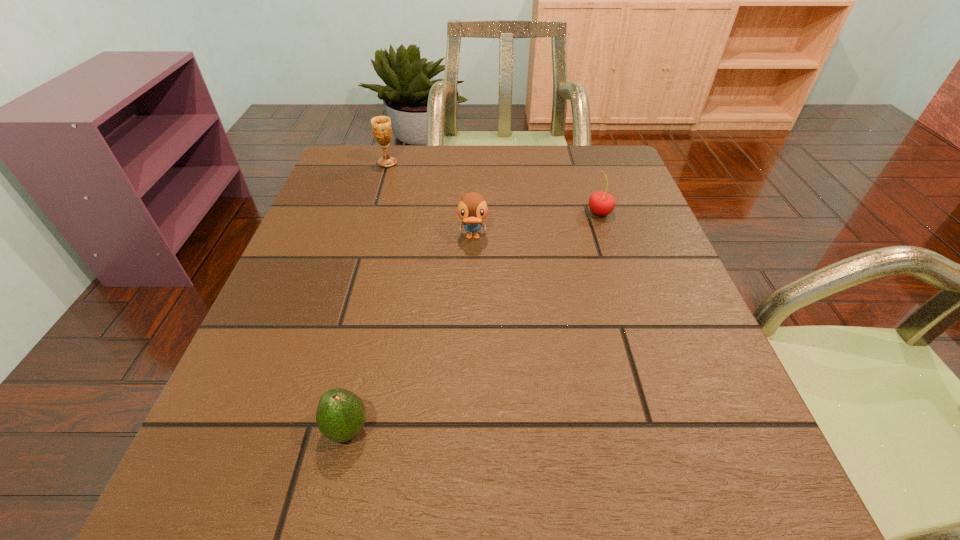
Identify the location of the farthest object. (381, 125).

Identify the location of the third nearest object. This screenshot has height=540, width=960. (601, 203).

Where is `the rightmost object`? The height and width of the screenshot is (540, 960). the rightmost object is located at coordinates (601, 203).

What are the coordinates of `the second nearest object` in the screenshot? It's located at (472, 208).

You are a GUI agent. You are given a task and a screenshot of the screen. Output one action in this format:
    pyautogui.click(x=<x>, y=<y>)
    Task: Click on the duck
    This screenshot has height=540, width=960.
    Given the screenshot: What is the action you would take?
    pyautogui.click(x=472, y=208)

This screenshot has height=540, width=960. I want to click on the nearest object, so point(340,416).

You are a GUI agent. You are given a task and a screenshot of the screen. Output one action in this format:
    pyautogui.click(x=<x>, y=<y>)
    Task: Click on the vacant space situated 0.260m on the front of the farthest object
    
    Given the screenshot: What is the action you would take?
    coord(368,229)

Identify the location of vacant region located on the front of the cherry. The height and width of the screenshot is (540, 960). (615, 259).

Where is `free region located on the front-facing side of the second nearest object`? free region located on the front-facing side of the second nearest object is located at coordinates (471, 318).

Find the location of a particular element. vacant area situated on the back of the nearest object is located at coordinates (358, 381).